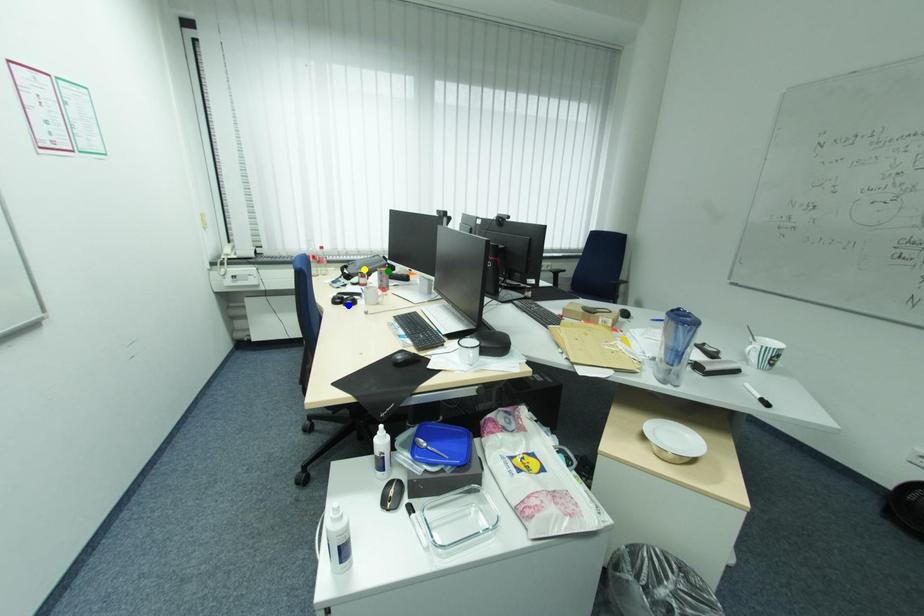
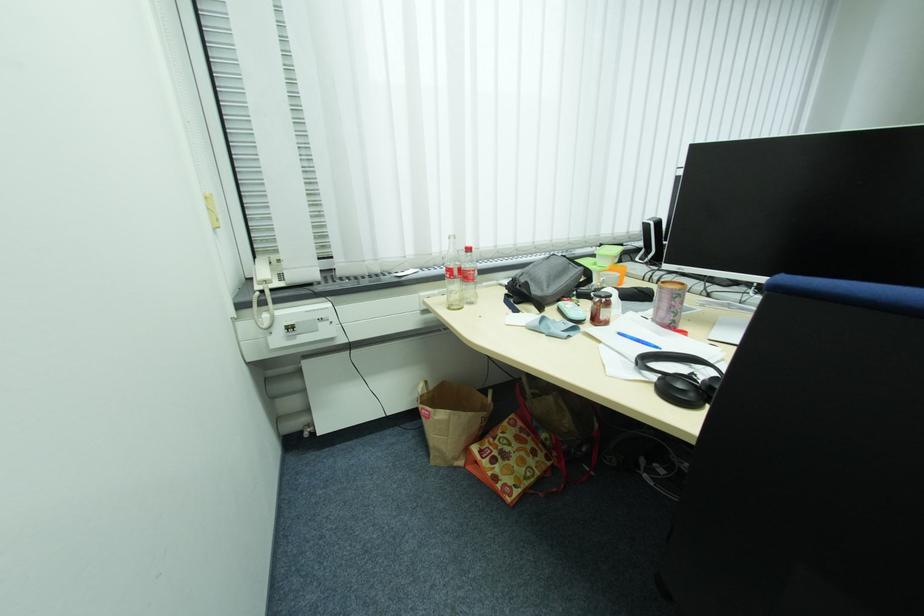
I am providing you with two images of the same scene from different viewpoints. Three points are marked in image1. Which point corresponds to a part or object that is occluded in image2?In image1, three points are marked. Which of them correspond to a part or object that is occluded in image2?Among the three points shown in image1, which one corresponds to a part or object that is no longer visible due to occlusion in image2?

blue point cannot be seen in image2.